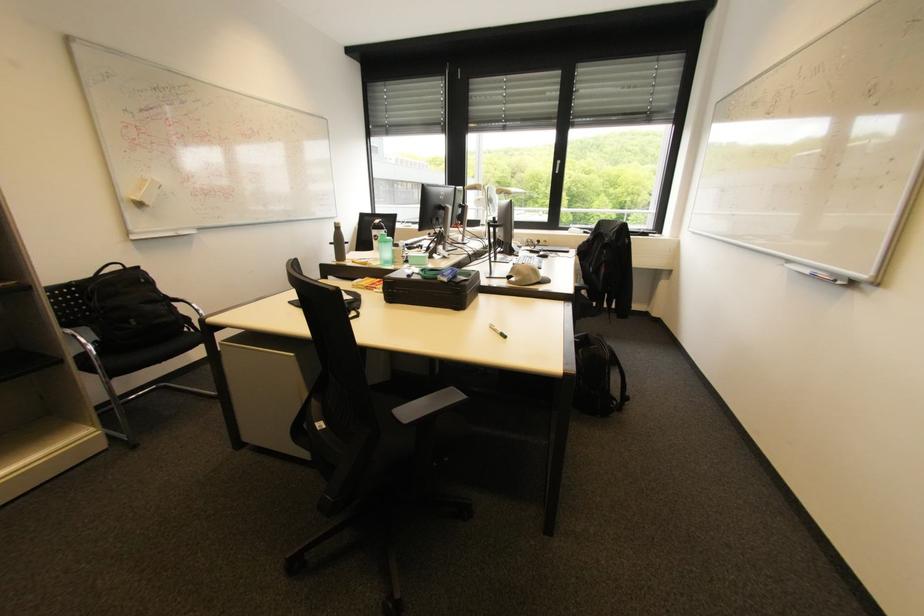
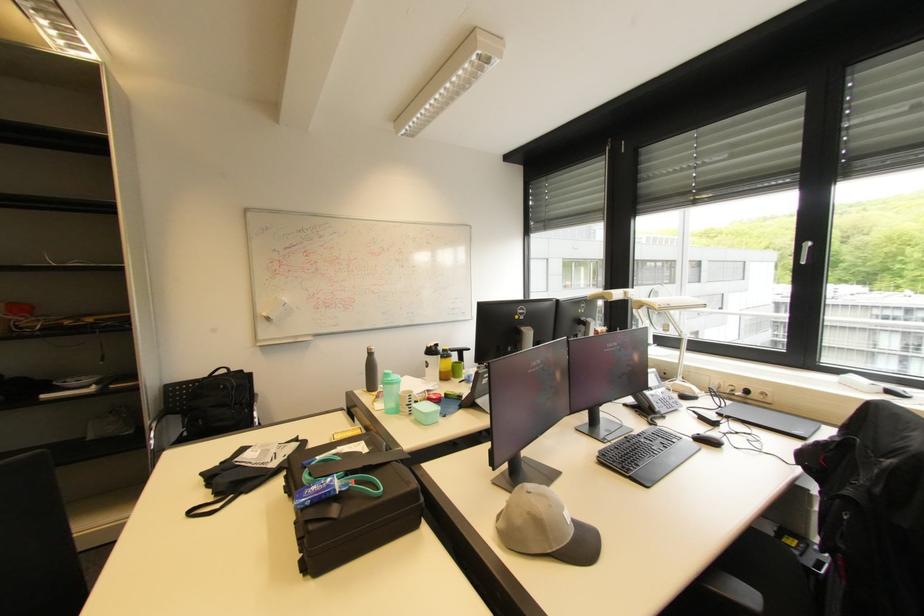
In the second image, find the point that corresponds to the point at 457,277 in the first image.

(321, 501)